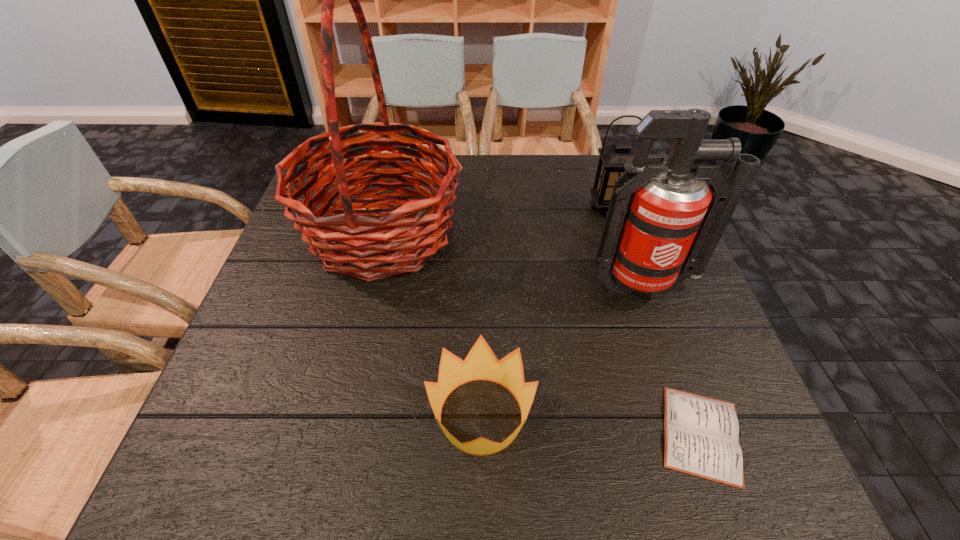
Find the location of `blank region between the tallest object and the fire extinguisher`. blank region between the tallest object and the fire extinguisher is located at coordinates (513, 259).

In order to click on vacant space in between the shortest object and the lantern in this screenshot , I will do `click(654, 321)`.

Where is `vacant region between the third shortest object and the second shortest object`? vacant region between the third shortest object and the second shortest object is located at coordinates (544, 312).

Where is `free space that is in between the diary and the fire extinguisher`? The image size is (960, 540). free space that is in between the diary and the fire extinguisher is located at coordinates 673,360.

Choose which object is the nearest neighbor to the diary. Please provide its 2D coordinates. Your answer should be formatted as a tuple, i.e. [(x, y)], where the tuple contains the x and y coordinates of a point satisfying the conditions above.

[(663, 225)]

I want to click on the fourth closest object to the shortest object, so click(613, 157).

Locate an element on the screen. This screenshot has height=540, width=960. vacant space that satisfies the following two spatial constraints: 1. on the back side of the shortest object; 2. on the handle side of the tallest object is located at coordinates (629, 232).

The width and height of the screenshot is (960, 540). In order to click on vacant position in the image that satisfies the following two spatial constraints: 1. on the front label side of the shortest object; 2. on the right side of the fire extinguisher in this screenshot , I will do `click(696, 434)`.

At what (x,y) coordinates should I click in order to perform the action: click on vacant space that satisfies the following two spatial constraints: 1. on the handle side of the basket; 2. on the back side of the crown. Please return your answer as a coordinate pair (x, y). The width and height of the screenshot is (960, 540). Looking at the image, I should click on point(339,415).

Locate an element on the screen. This screenshot has height=540, width=960. free space in the image that satisfies the following two spatial constraints: 1. on the front label side of the shortest object; 2. on the left side of the fire extinguisher is located at coordinates (696, 434).